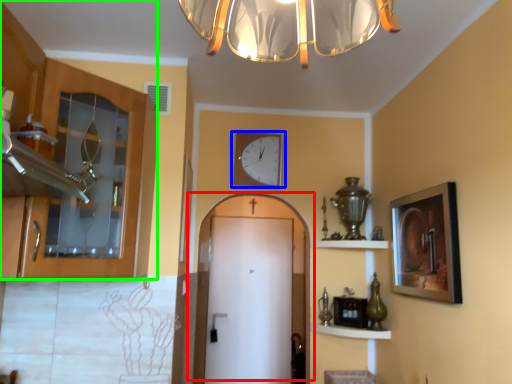
Question: Based on their relative distances, which object is nearer to door (highlighted by a red box)? Choose from wall clock (highlighted by a blue box) and cabinetry (highlighted by a green box).

Choices:
 (A) wall clock
 (B) cabinetry

Answer: (A)